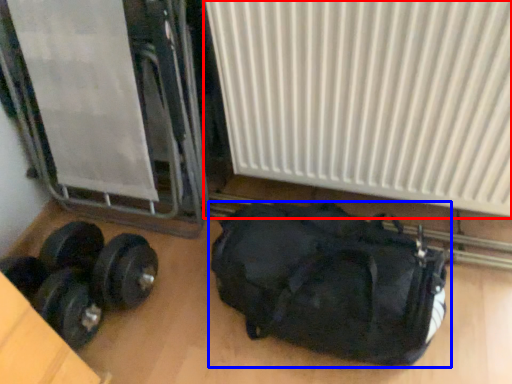
Question: Which point is closer to the camera, radiator (highlighted by a red box) or luggage and bags (highlighted by a blue box)?

Choices:
 (A) radiator
 (B) luggage and bags

Answer: (A)